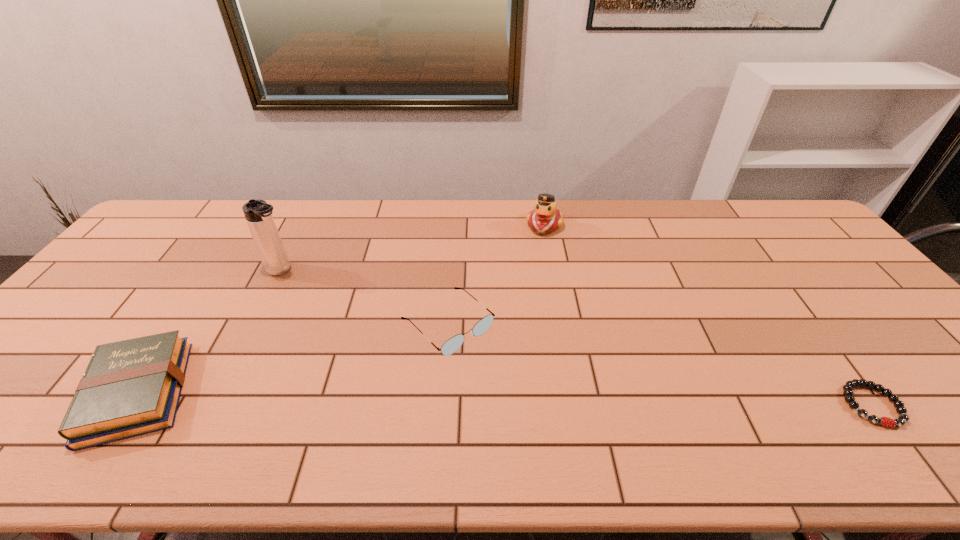
Locate an element on the screen. Image resolution: width=960 pixels, height=540 pixels. free space located on the face of the farthest object is located at coordinates (539, 247).

Locate an element on the screen. Image resolution: width=960 pixels, height=540 pixels. free region located on the face of the farthest object is located at coordinates (527, 291).

The height and width of the screenshot is (540, 960). I want to click on vacant position located 0.260m on the face of the farthest object, so click(527, 291).

Locate an element on the screen. vacant space positioned on the handle side of the fourth nearest object is located at coordinates (306, 284).

Locate an element on the screen. This screenshot has width=960, height=540. free space located 0.350m on the handle side of the fourth nearest object is located at coordinates (378, 327).

This screenshot has width=960, height=540. I want to click on vacant region located 0.390m on the handle side of the fourth nearest object, so click(x=389, y=334).

Where is `free region located 0.090m on the lenses of the third object from right to left`? Image resolution: width=960 pixels, height=540 pixels. free region located 0.090m on the lenses of the third object from right to left is located at coordinates (502, 375).

You are a GUI agent. You are given a task and a screenshot of the screen. Output one action in this format:
    pyautogui.click(x=<x>, y=<y>)
    Task: Click on the free space located 0.070m on the lenses of the third object from right to left
    
    Given the screenshot: What is the action you would take?
    pyautogui.click(x=496, y=370)

You are a GUI agent. You are given a task and a screenshot of the screen. Output one action in this format:
    pyautogui.click(x=<x>, y=<y>)
    Task: Click on the vacant space located on the lenses of the third object from right to left
    This screenshot has height=540, width=960.
    Given the screenshot: What is the action you would take?
    pyautogui.click(x=505, y=377)

Locate an element on the screen. The width and height of the screenshot is (960, 540). object at the far edge is located at coordinates (545, 217).